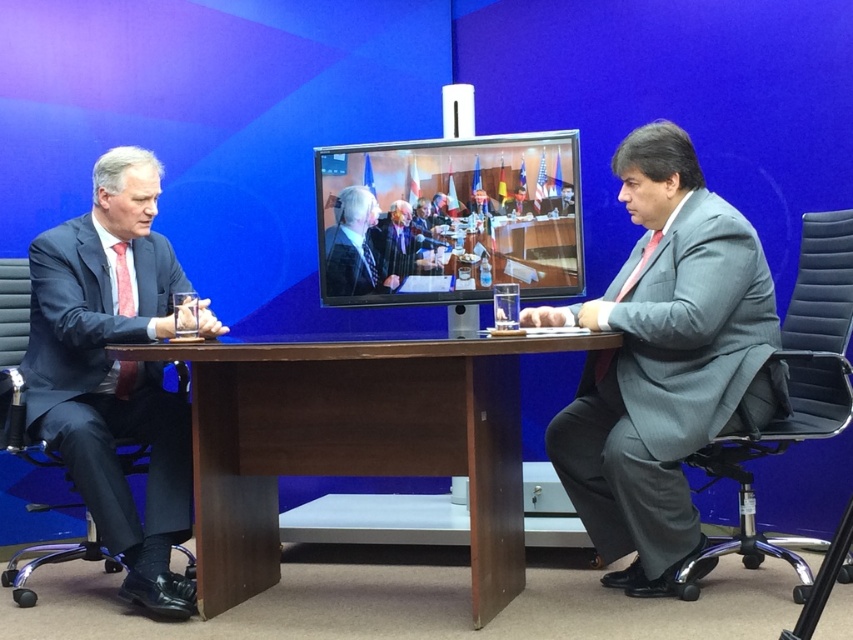
Question: Can you confirm if matte black suit at left is positioned above matte black suit at center?

Choices:
 (A) no
 (B) yes

Answer: (A)

Question: Which object is farther from the camera taking this photo?

Choices:
 (A) gray textured suit at right
 (B) matte black suit at left
 (C) brown wood table at center

Answer: (B)

Question: Is brown wood table at center positioned behind gray textured suit at right?

Choices:
 (A) no
 (B) yes

Answer: (A)

Question: Is brown wood table at center below gray textured suit at right?

Choices:
 (A) no
 (B) yes

Answer: (B)

Question: Which object is positioned closest to the matte black suit at left?

Choices:
 (A) brown wood table at center
 (B) matte black suit at center
 (C) gray textured suit at right

Answer: (A)

Question: Which is nearer to the matte black suit at left?

Choices:
 (A) matte black suit at center
 (B) gray textured suit at right

Answer: (A)